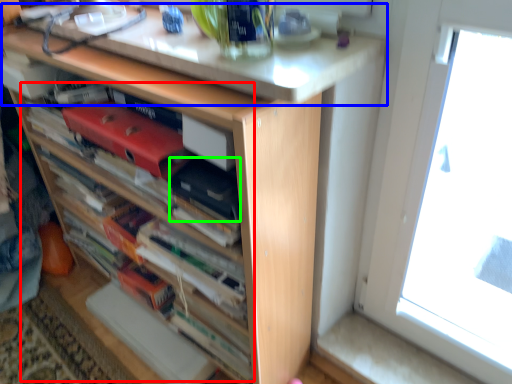
Question: Which is farther away from book (highlighted by a red box)? counter top (highlighted by a blue box) or paperback book (highlighted by a green box)?

Choices:
 (A) counter top
 (B) paperback book

Answer: (A)